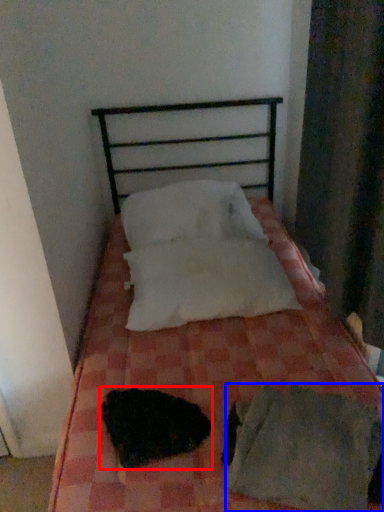
Question: Which of the following is the closest to the observer, animal (highlighted by a red box) or sheet (highlighted by a blue box)?

Choices:
 (A) animal
 (B) sheet

Answer: (B)